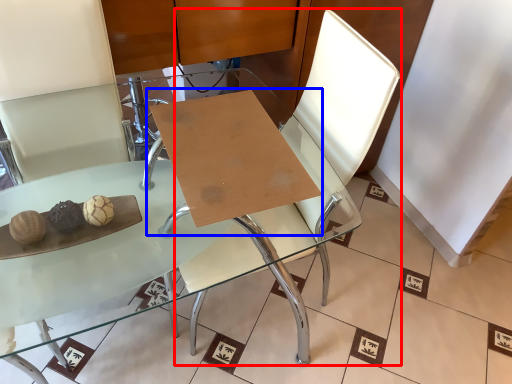
Question: Which object appears closest to the camera in this image, swivel chair (highlighted by a red box) or table (highlighted by a blue box)?

Choices:
 (A) swivel chair
 (B) table

Answer: (A)